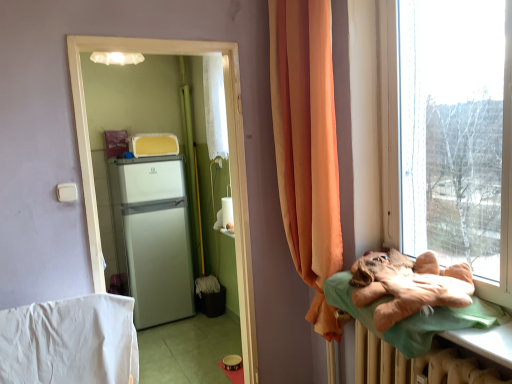
Where is `brown plush bear at right`? The width and height of the screenshot is (512, 384). brown plush bear at right is located at coordinates (404, 317).

The image size is (512, 384). Find the location of `white matte refrigerator at left`. white matte refrigerator at left is located at coordinates click(x=153, y=236).

Locate an element on the screen. This screenshot has height=384, width=512. orange fabric curtain at right is located at coordinates (307, 146).

This screenshot has width=512, height=384. Find the location of `brown plush bear at right`. brown plush bear at right is located at coordinates pyautogui.click(x=404, y=317).

Consider the image. Between orange fabric curtain at right and white glossy refrigerator at center, which one has more height?

white glossy refrigerator at center.

From the image's perspective, is orange fabric curtain at right above white glossy refrigerator at center?

Indeed, from the image's perspective, orange fabric curtain at right is shown above white glossy refrigerator at center.

Looking at this image, is orange fabric curtain at right turned away from white glossy refrigerator at center?

No, orange fabric curtain at right is not facing the opposite direction of white glossy refrigerator at center.

Which object is more forward, orange fabric curtain at right or white glossy refrigerator at center?

orange fabric curtain at right is in front.

Who is shorter, white matte refrigerator at left or white cotton blanket at lower left?

Standing shorter between the two is white cotton blanket at lower left.

Is point (112, 172) farther from viewer compared to point (76, 343)?

Yes, it is behind point (76, 343).

Would you say white cotton blanket at lower left is part of white matte refrigerator at left's contents?

No.

Considering the relative sizes of white glossy refrigerator at center and white cotton blanket at lower left in the image provided, is white glossy refrigerator at center wider than white cotton blanket at lower left?

No.

Locate an element on the screen. blanket on the left of white glossy refrigerator at center is located at coordinates (70, 341).

From the picture: Could you tell me if white glossy refrigerator at center is facing white cotton blanket at lower left?

No, white glossy refrigerator at center does not turn towards white cotton blanket at lower left.

Measure the distance from white glossy refrigerator at center to white cotton blanket at lower left.

They are 15.97 inches apart.

Is orange fabric curtain at right at the left side of brown plush bear at right?

Yes, orange fabric curtain at right is to the left of brown plush bear at right.

From a real-world perspective, which is physically below, orange fabric curtain at right or brown plush bear at right?

brown plush bear at right, from a real-world perspective.

Which object is thinner, orange fabric curtain at right or brown plush bear at right?

orange fabric curtain at right.

Is orange fabric curtain at right positioned far away from brown plush bear at right?

orange fabric curtain at right is actually quite close to brown plush bear at right.

How far apart are white matte refrigerator at left and orange fabric curtain at right?

white matte refrigerator at left is 1.74 meters from orange fabric curtain at right.

Is white matte refrigerator at left oriented towards orange fabric curtain at right?

Yes, white matte refrigerator at left is aimed at orange fabric curtain at right.

Considering the relative sizes of white matte refrigerator at left and orange fabric curtain at right in the image provided, is white matte refrigerator at left wider than orange fabric curtain at right?

Indeed, white matte refrigerator at left has a greater width compared to orange fabric curtain at right.

Can orange fabric curtain at right be found inside white matte refrigerator at left?

Actually, orange fabric curtain at right is outside white matte refrigerator at left.

Considering the sizes of white cotton blanket at lower left and white glossy refrigerator at center in the image, is white cotton blanket at lower left wider or thinner than white glossy refrigerator at center?

Considering their sizes, white cotton blanket at lower left looks broader than white glossy refrigerator at center.

Are white cotton blanket at lower left and white glossy refrigerator at center located far from each other?

No, there isn't a large distance between white cotton blanket at lower left and white glossy refrigerator at center.

Is white cotton blanket at lower left positioned behind white glossy refrigerator at center?

No.

Is point (104, 296) less distant than point (133, 47)?

Yes, point (104, 296) is in front of point (133, 47).

Can you confirm if white matte refrigerator at left is taller than brown plush bear at right?

Correct, white matte refrigerator at left is much taller as brown plush bear at right.

From a real-world perspective, between white matte refrigerator at left and brown plush bear at right, who is vertically higher?

From a 3D spatial view, brown plush bear at right is above.

Find the location of a particular element. hospital bed on the right of white matte refrigerator at left is located at coordinates (404, 317).

Between white matte refrigerator at left and brown plush bear at right, which one appears on the left side from the viewer's perspective?

Positioned to the left is white matte refrigerator at left.

This screenshot has height=384, width=512. In order to click on screen door behind the orange fabric curtain at right in this screenshot , I will do `click(230, 163)`.

The image size is (512, 384). I want to click on blanket that is on the right side of white matte refrigerator at left, so click(x=70, y=341).

Looking at the image, which one is located further to white glossy refrigerator at center, orange fabric curtain at right or brown plush bear at right?

The object further to white glossy refrigerator at center is brown plush bear at right.

Estimate the real-world distances between objects in this image. Which object is closer to white cotton blanket at lower left, white matte refrigerator at left or white glossy refrigerator at center?

Among the two, white glossy refrigerator at center is located nearer to white cotton blanket at lower left.

When comparing their distances from white glossy refrigerator at center, does brown plush bear at right or orange fabric curtain at right seem closer?

Based on the image, orange fabric curtain at right appears to be nearer to white glossy refrigerator at center.

Estimate the real-world distances between objects in this image. Which object is further from white cotton blanket at lower left, white glossy refrigerator at center or orange fabric curtain at right?

orange fabric curtain at right.

When comparing their distances from white glossy refrigerator at center, does white matte refrigerator at left or brown plush bear at right seem closer?

brown plush bear at right is positioned closer to the anchor white glossy refrigerator at center.

Estimate the real-world distances between objects in this image. Which object is further from orange fabric curtain at right, brown plush bear at right or white glossy refrigerator at center?

brown plush bear at right is further to orange fabric curtain at right.

From the image, which object appears to be nearer to orange fabric curtain at right, brown plush bear at right or white cotton blanket at lower left?

brown plush bear at right.

Looking at the image, which one is located closer to white cotton blanket at lower left, brown plush bear at right or white matte refrigerator at left?

Among the two, brown plush bear at right is located nearer to white cotton blanket at lower left.

At what (x,y) coordinates should I click in order to perform the action: click on screen door positioned between white cotton blanket at lower left and white matte refrigerator at left from near to far. Please return your answer as a coordinate pair (x, y). The height and width of the screenshot is (384, 512). Looking at the image, I should click on (230, 163).

Find the location of `curtain between brown plush bear at right and white matte refrigerator at left in the front-back direction`. curtain between brown plush bear at right and white matte refrigerator at left in the front-back direction is located at coordinates (307, 146).

Identify the location of curtain between white cotton blanket at lower left and white matte refrigerator at left in the front-back direction. This screenshot has width=512, height=384. (307, 146).

At what (x,y) coordinates should I click in order to perform the action: click on screen door positioned between orange fabric curtain at right and white matte refrigerator at left from near to far. Please return your answer as a coordinate pair (x, y). The width and height of the screenshot is (512, 384). Looking at the image, I should click on (230, 163).